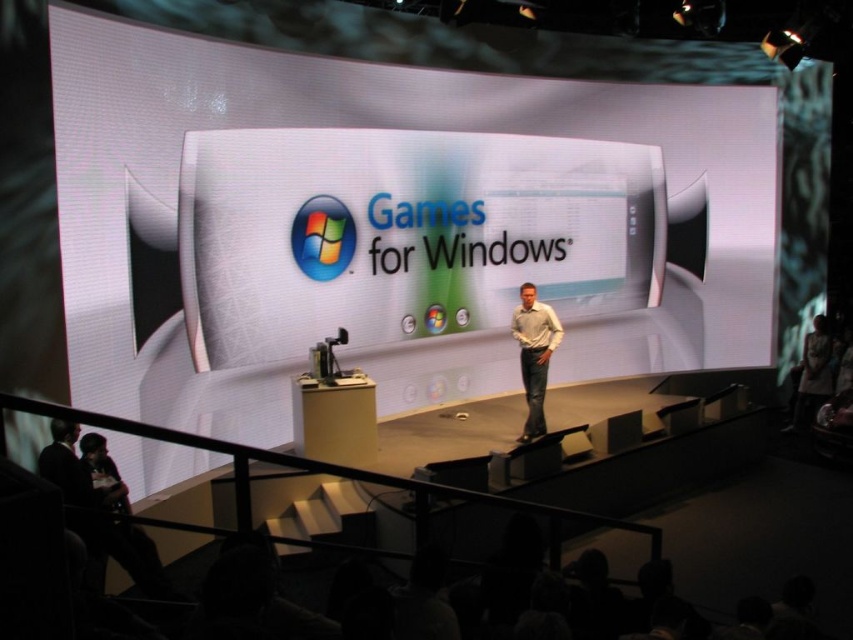
Does white glossy projection screen at center appear under light gray shirt at center?

No, white glossy projection screen at center is not below light gray shirt at center.

Does point (218, 156) lie behind point (527, 372)?

No, (218, 156) is in front of (527, 372).

Identify the location of white glossy projection screen at center. (404, 234).

The height and width of the screenshot is (640, 853). I want to click on white glossy projection screen at center, so click(x=404, y=234).

Is white glossy projection screen at center positioned at the back of light brown leather jacket at right?

No, it is not.

Is point (350, 163) positioned after point (825, 316)?

No, it is not.

Who is more distant from viewer, (x=407, y=332) or (x=809, y=362)?

Positioned behind is point (x=809, y=362).

At what (x,y) coordinates should I click in order to perform the action: click on white glossy projection screen at center. Please return your answer as a coordinate pair (x, y). Looking at the image, I should click on (404, 234).

Describe the element at coordinates (534, 353) in the screenshot. The width and height of the screenshot is (853, 640). I see `light gray shirt at center` at that location.

Who is positioned more to the right, light gray shirt at center or light brown leather jacket at right?

light brown leather jacket at right is more to the right.

Is point (537, 349) positioned in front of point (810, 376)?

Yes.

Identify the location of light gray shirt at center. This screenshot has height=640, width=853. (534, 353).